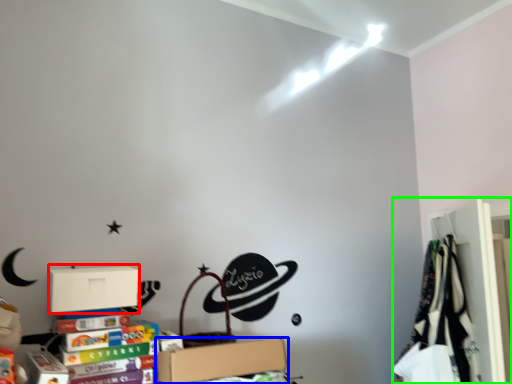
Question: Which object is the closest to the cardboard box (highlighted by a red box)? Choose among these: box (highlighted by a blue box) or closet (highlighted by a green box).

Choices:
 (A) box
 (B) closet

Answer: (A)